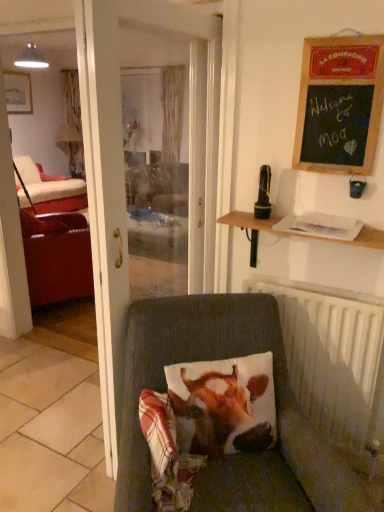
The width and height of the screenshot is (384, 512). I want to click on leather couch at left, so click(57, 257).

The image size is (384, 512). Describe the element at coordinates (114, 170) in the screenshot. I see `white glossy door at center` at that location.

What do you see at coordinates (263, 194) in the screenshot? I see `black rubberized phone at upper right` at bounding box center [263, 194].

In order to face white metallic radiator at lower right, should I rotate leftwards or rightwards?

You should look right and rotate roughly 14.814 degrees.

Where is `leather couch at left`? The width and height of the screenshot is (384, 512). leather couch at left is located at coordinates (57, 257).

Does printed fabric cow at center turn towards black chalkboard at upper right?

No, printed fabric cow at center is not facing towards black chalkboard at upper right.

Which object is more forward, printed fabric cow at center or black chalkboard at upper right?

printed fabric cow at center is more forward.

In order to click on bulletin board above the printed fabric cow at center (from the image's perspective) in this screenshot , I will do `click(339, 104)`.

Is printed fabric cow at center taller than black chalkboard at upper right?

No, printed fabric cow at center is not taller than black chalkboard at upper right.

Who is smaller, printed fabric cow at center or black rubberized phone at upper right?

black rubberized phone at upper right is smaller.

Could you tell me if printed fabric cow at center is facing black rubberized phone at upper right?

No, printed fabric cow at center is not aimed at black rubberized phone at upper right.

Considering the sizes of printed fabric cow at center and black rubberized phone at upper right in the image, is printed fabric cow at center wider or thinner than black rubberized phone at upper right?

printed fabric cow at center is wider than black rubberized phone at upper right.

Considering the sizes of velvet cushion at lower center and printed fabric cow at center in the image, is velvet cushion at lower center wider or thinner than printed fabric cow at center?

velvet cushion at lower center is wider than printed fabric cow at center.

Between velvet cushion at lower center and printed fabric cow at center, which one appears on the left side from the viewer's perspective?

velvet cushion at lower center.

Which of these two, white glossy door at center or black rubberized phone at upper right, stands shorter?

Standing shorter between the two is black rubberized phone at upper right.

Does white glossy door at center turn towards black rubberized phone at upper right?

Yes, white glossy door at center is turned towards black rubberized phone at upper right.

Considering the relative sizes of white glossy door at center and black rubberized phone at upper right in the image provided, is white glossy door at center wider than black rubberized phone at upper right?

Yes, white glossy door at center is wider than black rubberized phone at upper right.

Looking at this image, from the image's perspective, is white glossy door at center located beneath black rubberized phone at upper right?

Yes.

Considering the relative positions of velvet cushion at lower center and leather couch at left in the image provided, is velvet cushion at lower center behind leather couch at left?

That is False.

From the picture: Is velvet cushion at lower center thinner than leather couch at left?

No, velvet cushion at lower center is not thinner than leather couch at left.

Is there a large distance between velvet cushion at lower center and leather couch at left?

Yes, velvet cushion at lower center and leather couch at left are located far from each other.

Locate an element on the screen. studio couch above the velvet cushion at lower center (from the image's perspective) is located at coordinates (57, 257).

Is white metallic radiator at lower right closer to the viewer compared to printed fabric cow at center?

No, white metallic radiator at lower right is behind printed fabric cow at center.

Does white metallic radiator at lower right touch printed fabric cow at center?

No, white metallic radiator at lower right is not next to printed fabric cow at center.

Considering the points (297, 309) and (255, 442), which point is behind, point (297, 309) or point (255, 442)?

The point (297, 309) is farther from the camera.

From the image's perspective, is white metallic radiator at lower right located beneath printed fabric cow at center?

No, from the image's perspective, white metallic radiator at lower right is not beneath printed fabric cow at center.

Is black chalkboard at upper right surrounding white glossy door at center?

That's incorrect, white glossy door at center is not inside black chalkboard at upper right.

How different are the orientations of black chalkboard at upper right and white glossy door at center in degrees?

They differ by 94.3 degrees in their facing directions.

Does black chalkboard at upper right have a lesser height compared to white glossy door at center?

Correct, black chalkboard at upper right is not as tall as white glossy door at center.

Can you confirm if black chalkboard at upper right is thinner than white glossy door at center?

Yes.

In the image, there is a black chalkboard at upper right. Where is `cattle below it (from the image's perspective)`? This screenshot has height=512, width=384. cattle below it (from the image's perspective) is located at coordinates (221, 412).

Image resolution: width=384 pixels, height=512 pixels. In order to click on cattle lying on the left of black rubberized phone at upper right in this screenshot , I will do `click(221, 412)`.

Estimate the real-world distances between objects in this image. Which object is closer to velvet cushion at lower center, black rubberized phone at upper right or white glossy door at center?

Based on the image, white glossy door at center appears to be nearer to velvet cushion at lower center.

From the image, which object appears to be nearer to black rubberized phone at upper right, white glossy door at center or white metallic radiator at lower right?

The object closer to black rubberized phone at upper right is white metallic radiator at lower right.

Based on the photo, estimate the real-world distances between objects in this image. Which object is further from white metallic radiator at lower right, velvet cushion at lower center or leather couch at left?

leather couch at left.

Consider the image. Looking at the image, which one is located further to printed fabric cow at center, white glossy door at center or velvet cushion at lower center?

white glossy door at center is further to printed fabric cow at center.

From the image, which object appears to be nearer to black chalkboard at upper right, leather couch at left or black rubberized phone at upper right?

black rubberized phone at upper right is closer to black chalkboard at upper right.

Estimate the real-world distances between objects in this image. Which object is further from black rubberized phone at upper right, white metallic radiator at lower right or white glossy door at center?

The object further to black rubberized phone at upper right is white glossy door at center.

From the image, which object appears to be nearer to printed fabric cow at center, black rubberized phone at upper right or leather couch at left?

The object closer to printed fabric cow at center is black rubberized phone at upper right.

Based on their spatial positions, is black chalkboard at upper right or black rubberized phone at upper right further from velvet cushion at lower center?

Among the two, black chalkboard at upper right is located further to velvet cushion at lower center.

At what (x,y) coordinates should I click in order to perform the action: click on corded phone between white glossy door at center and black chalkboard at upper right. Please return your answer as a coordinate pair (x, y). The width and height of the screenshot is (384, 512). Looking at the image, I should click on [263, 194].

In order to click on radiator located between white glossy door at center and leather couch at left in the depth direction in this screenshot , I will do `click(335, 362)`.

Where is `door between black rubberized phone at upper right and white metallic radiator at lower right in the up-down direction`? door between black rubberized phone at upper right and white metallic radiator at lower right in the up-down direction is located at coordinates (114, 170).

Locate an element on the screen. radiator positioned between velvet cushion at lower center and leather couch at left from near to far is located at coordinates pyautogui.click(x=335, y=362).